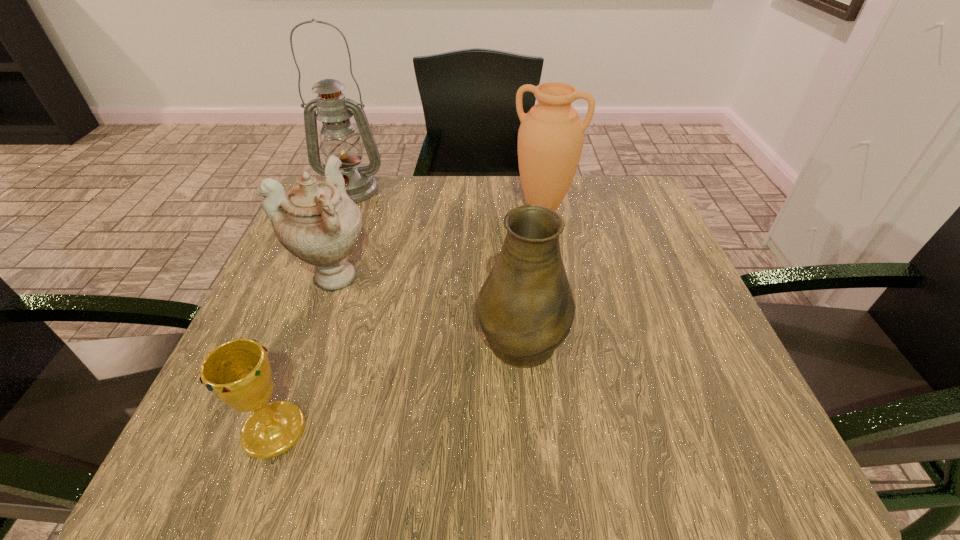
I want to click on free spot located on the handle side of the pitcher, so click(x=514, y=244).

Locate an element on the screen. The width and height of the screenshot is (960, 540). vacant area situated 0.100m on the handle side of the pitcher is located at coordinates (516, 265).

You are a GUI agent. You are given a task and a screenshot of the screen. Output one action in this format:
    pyautogui.click(x=<x>, y=<y>)
    Task: Click on the free space located on the handle side of the pitcher
    The image size is (960, 540).
    Given the screenshot: What is the action you would take?
    pyautogui.click(x=509, y=190)

Find the location of `free space located on the right of the shorter urn`. free space located on the right of the shorter urn is located at coordinates (503, 276).

Where is `free spot located 0.350m on the back of the shortest object`? Image resolution: width=960 pixels, height=540 pixels. free spot located 0.350m on the back of the shortest object is located at coordinates (337, 256).

Locate an element on the screen. The image size is (960, 540). oil lamp that is positioned at the far edge is located at coordinates (339, 137).

Identify the location of urn located in the far edge section of the desktop. (550, 139).

I want to click on object that is at the near edge, so click(238, 372).

Locate an element on the screen. oil lamp located in the left edge section of the desktop is located at coordinates (339, 137).

The image size is (960, 540). Identify the location of urn located in the left edge section of the desktop. (316, 221).